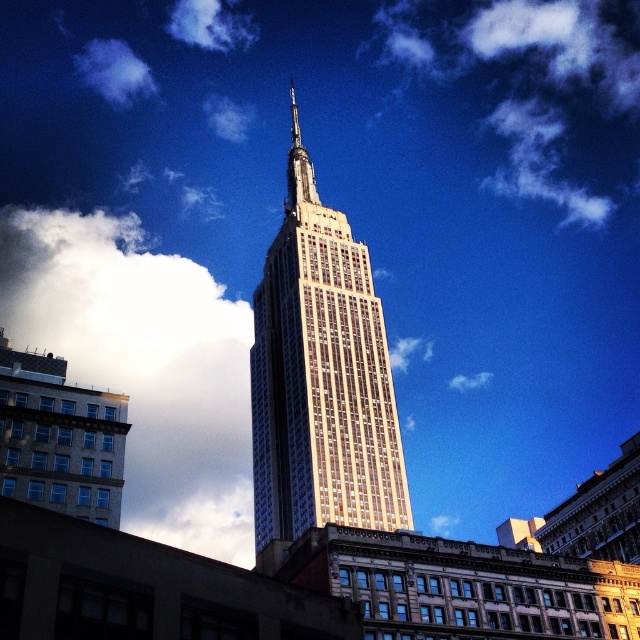
Question: Among these objects, which one is nearest to the camera?

Choices:
 (A) white fluffy cloud at upper left
 (B) white fluffy cloud at upper center

Answer: (B)

Question: Is gold glass tower at center wider than white fluffy cloud at upper center?

Choices:
 (A) no
 (B) yes

Answer: (B)

Question: Does shiny silver spire at center lie in front of white fluffy cloud at upper center?

Choices:
 (A) no
 (B) yes

Answer: (B)

Question: Which object is farther from the camera taking this photo?

Choices:
 (A) gold glass tower at center
 (B) shiny silver spire at center

Answer: (B)

Question: Which point is farther to the camera?

Choices:
 (A) white fluffy cloud at upper center
 (B) shiny silver spire at center

Answer: (A)

Question: Can you confirm if shiny silver spire at center is positioned above white fluffy cloud at upper center?

Choices:
 (A) no
 (B) yes

Answer: (B)